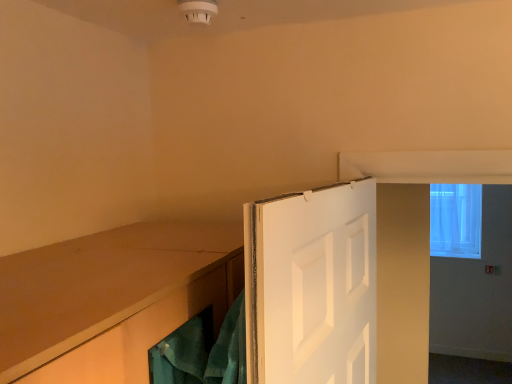
Question: From a real-world perspective, relative to transparent fabric window at upper right, is white painted wood door at center vertically above or below?

Choices:
 (A) below
 (B) above

Answer: (B)

Question: Is white painted wood door at center in front of or behind transparent fabric window at upper right in the image?

Choices:
 (A) behind
 (B) front

Answer: (B)

Question: Is point (287, 369) positioned closer to the camera than point (474, 244)?

Choices:
 (A) closer
 (B) farther

Answer: (A)

Question: Considering the positions of transparent fabric window at upper right and white painted wood door at center in the image, is transparent fabric window at upper right taller or shorter than white painted wood door at center?

Choices:
 (A) short
 (B) tall

Answer: (B)

Question: Does point (466, 246) appear closer or farther from the camera than point (373, 329)?

Choices:
 (A) farther
 (B) closer

Answer: (A)

Question: Looking at their shapes, would you say transparent fabric window at upper right is wider or thinner than white painted wood door at center?

Choices:
 (A) wide
 (B) thin

Answer: (A)

Question: Considering the relative positions of transparent fabric window at upper right and white painted wood door at center in the image provided, is transparent fabric window at upper right to the left or to the right of white painted wood door at center?

Choices:
 (A) left
 (B) right

Answer: (B)